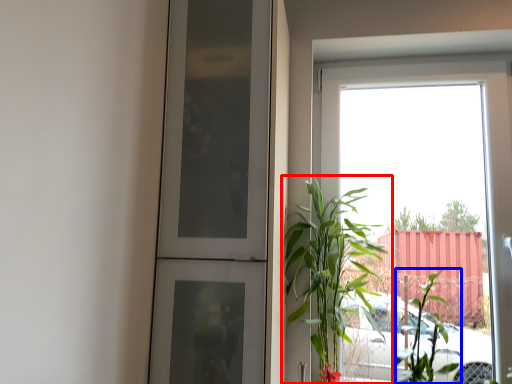
Question: Which of the following is the closest to the observer, houseplant (highlighted by a red box) or plant (highlighted by a blue box)?

Choices:
 (A) houseplant
 (B) plant

Answer: (A)